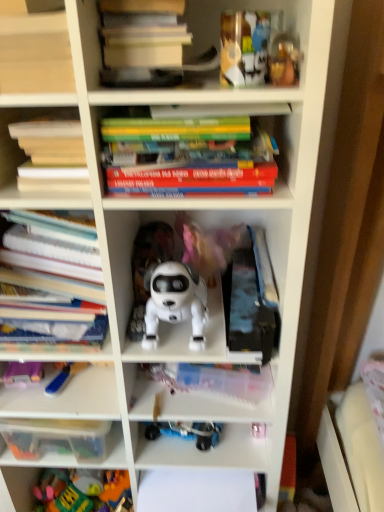
Question: Does metallic gold toy at upper right, which is counted as the 1th toy, starting from the top, have a smaller size compared to blue plastic toy at lower left, marked as the 2th toy in a bottom-to-top arrangement?

Choices:
 (A) no
 (B) yes

Answer: (A)

Question: Can you confirm if metallic gold toy at upper right, the fourth toy positioned from the back, is bigger than blue plastic toy at lower left, the third toy positioned from the front?

Choices:
 (A) yes
 (B) no

Answer: (A)

Question: Is metallic gold toy at upper right, the first toy positioned from the right, directly adjacent to blue plastic toy at lower left, which appears as the 3th toy when viewed from the top?

Choices:
 (A) no
 (B) yes

Answer: (A)

Question: Is metallic gold toy at upper right, which appears as the first toy when viewed from the front, at the right side of blue plastic toy at lower left, placed as the 2th toy when sorted from back to front?

Choices:
 (A) no
 (B) yes

Answer: (B)

Question: Is metallic gold toy at upper right, which is counted as the 1th toy, starting from the top, in front of blue plastic toy at lower left, which appears as the 3th toy when viewed from the top?

Choices:
 (A) yes
 (B) no

Answer: (A)

Question: From a real-world perspective, is hardcover books at center, marked as the third book in a bottom-to-top arrangement, physically located above or below white matte robot dog at center, which is the third toy from left to right?

Choices:
 (A) above
 (B) below

Answer: (A)

Question: Would you say hardcover books at center, marked as the third book in a bottom-to-top arrangement, is to the left or to the right of white matte robot dog at center, which appears as the 2th toy when viewed from the front, in the picture?

Choices:
 (A) left
 (B) right

Answer: (B)

Question: Would you say hardcover books at center, the 2th book viewed from the top, is inside or outside white matte robot dog at center, the second toy positioned from the right?

Choices:
 (A) outside
 (B) inside

Answer: (A)

Question: Considering the positions of hardcover books at center, the 2th book viewed from the top, and white matte robot dog at center, the second toy in the top-to-bottom sequence, in the image, is hardcover books at center, the 2th book viewed from the top, bigger or smaller than white matte robot dog at center, the second toy in the top-to-bottom sequence,?

Choices:
 (A) small
 (B) big

Answer: (B)

Question: Is white paper at left, which is the first book in bottom-to-top order, inside the boundaries of plastic colorful toys at lower left, positioned as the fourth toy in front-to-back order, or outside?

Choices:
 (A) outside
 (B) inside

Answer: (A)

Question: Is point (79, 266) closer or farther from the camera than point (69, 485)?

Choices:
 (A) farther
 (B) closer

Answer: (B)

Question: Is white paper at left, arranged as the fourth book when viewed from the top, to the left or to the right of plastic colorful toys at lower left, placed as the fourth toy when sorted from top to bottom, in the image?

Choices:
 (A) left
 (B) right

Answer: (B)

Question: From a real-world perspective, is white paper at left, which is the first book in bottom-to-top order, positioned above or below plastic colorful toys at lower left, placed as the fourth toy when sorted from top to bottom?

Choices:
 (A) above
 (B) below

Answer: (A)

Question: Is point (51, 146) closer or farther from the camera than point (39, 489)?

Choices:
 (A) farther
 (B) closer

Answer: (B)

Question: Is hardcover book at upper left, the third book positioned from the top, in front of or behind plastic colorful toys at lower left, placed as the fourth toy when sorted from top to bottom, in the image?

Choices:
 (A) behind
 (B) front

Answer: (B)